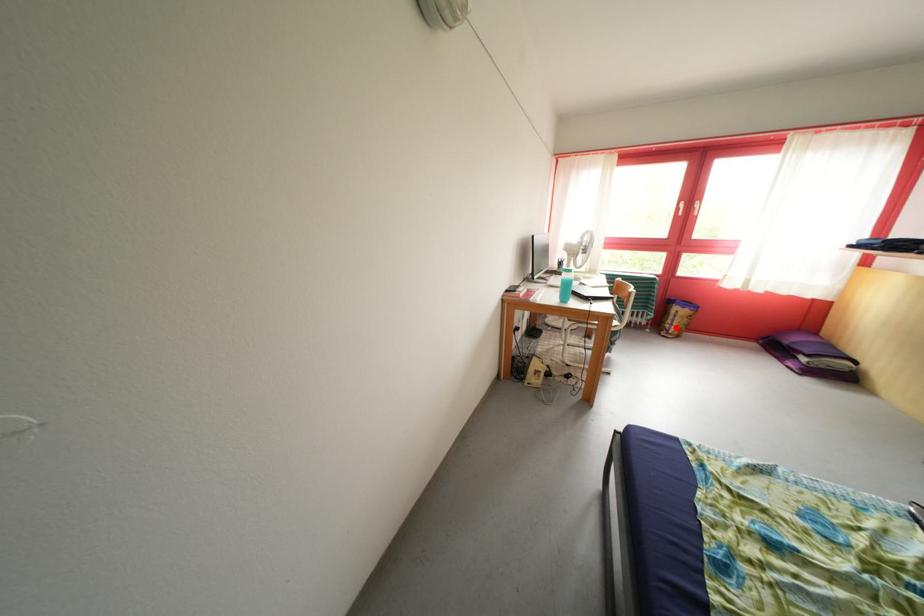
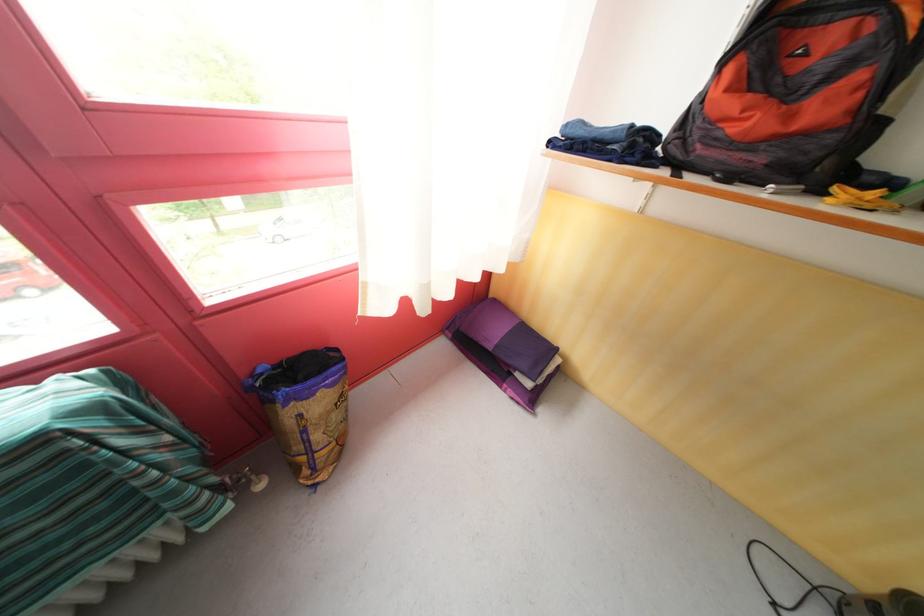
Question: I am providing you with two images of the same scene from different viewpoints. Given a red point in image1, look at the same physical point in image2. Is it:

Choices:
 (A) Closer to the viewpoint
 (B) Farther from the viewpoint

Answer: (B)